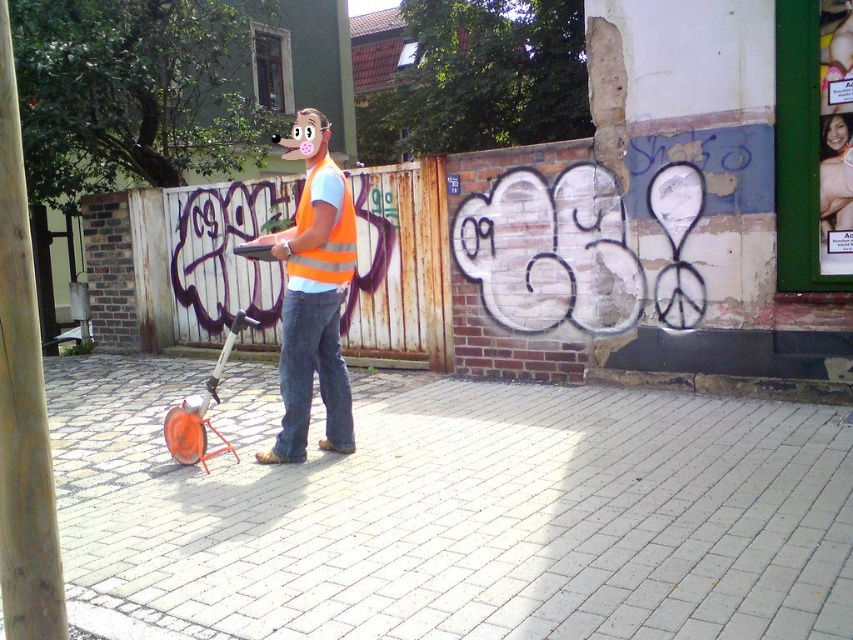
Question: Does wooden pole at left come in front of orange reflective vest at center?

Choices:
 (A) no
 (B) yes

Answer: (B)

Question: Which point appears farthest from the camera in this image?

Choices:
 (A) (393, 403)
 (B) (13, 189)
 (C) (300, 388)
 (D) (305, 184)

Answer: (A)

Question: Among these objects, which one is farthest from the camera?

Choices:
 (A) orange reflective safety vest at center
 (B) wooden pole at left
 (C) white brick pavement at center

Answer: (A)

Question: Which point is farther to the camera?

Choices:
 (A) orange reflective safety vest at center
 (B) white brick pavement at center

Answer: (A)

Question: Does white brick pavement at center appear under orange reflective safety vest at center?

Choices:
 (A) yes
 (B) no

Answer: (A)

Question: In this image, where is wooden pole at left located relative to orange reflective vest at center?

Choices:
 (A) right
 (B) left

Answer: (B)